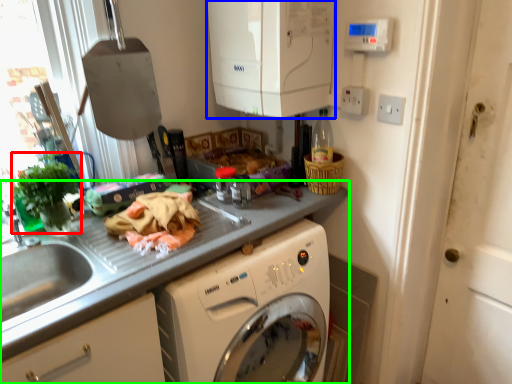
Question: Which is nearer to the plant (highlighted by a red box)? appliance (highlighted by a blue box) or countertop (highlighted by a green box).

Choices:
 (A) appliance
 (B) countertop

Answer: (B)